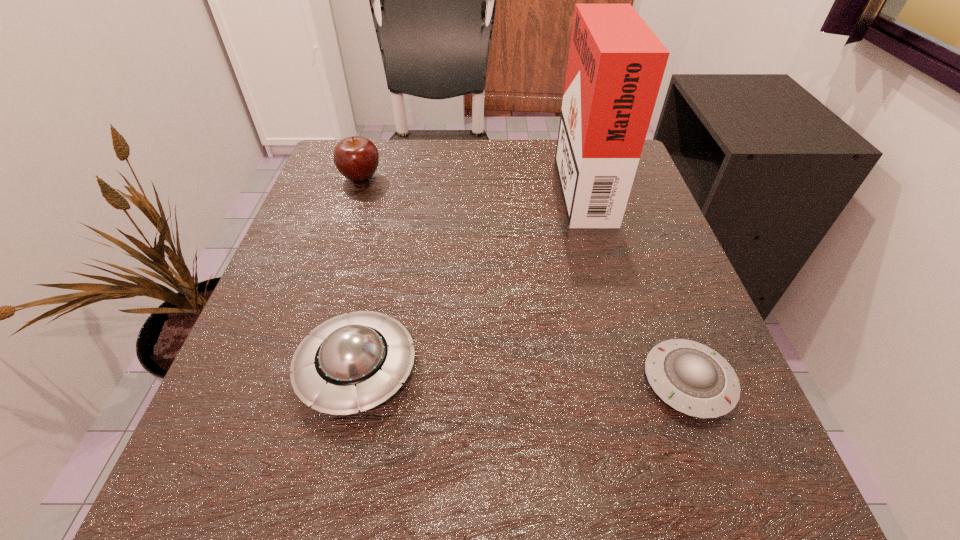
The height and width of the screenshot is (540, 960). What are the coordinates of `vacant point that satisfies the following two spatial constraints: 1. on the front side of the second tallest object; 2. on the left side of the second shortest object` in the screenshot? It's located at (297, 369).

Where is `vacant region that satisfies the following two spatial constraints: 1. on the back side of the shortest object; 2. on the front-facing side of the tallest object`? This screenshot has height=540, width=960. vacant region that satisfies the following two spatial constraints: 1. on the back side of the shortest object; 2. on the front-facing side of the tallest object is located at coordinates (614, 183).